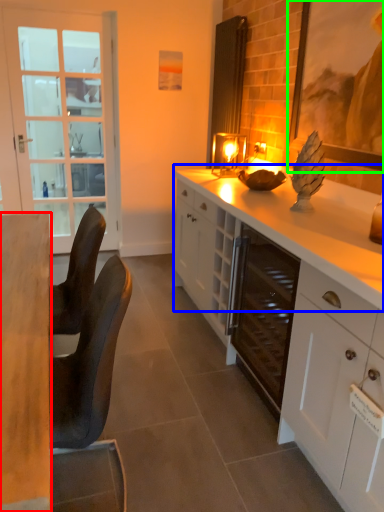
Question: Estimate the real-world distances between objects in this image. Which object is farther from desk (highlighted by a red box), countertop (highlighted by a blue box) or picture frame (highlighted by a green box)?

Choices:
 (A) countertop
 (B) picture frame

Answer: (B)